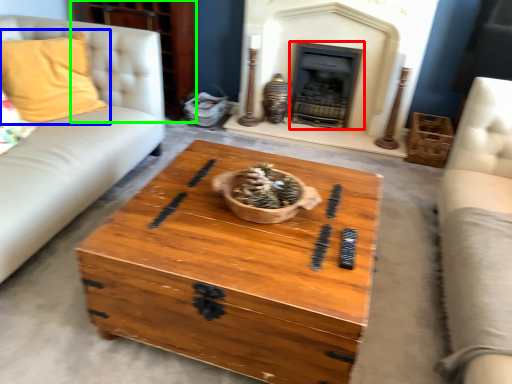
Question: Which is nearer to the fireplace (highlighted by a red box)? pillow (highlighted by a blue box) or dresser (highlighted by a green box).

Choices:
 (A) pillow
 (B) dresser

Answer: (B)